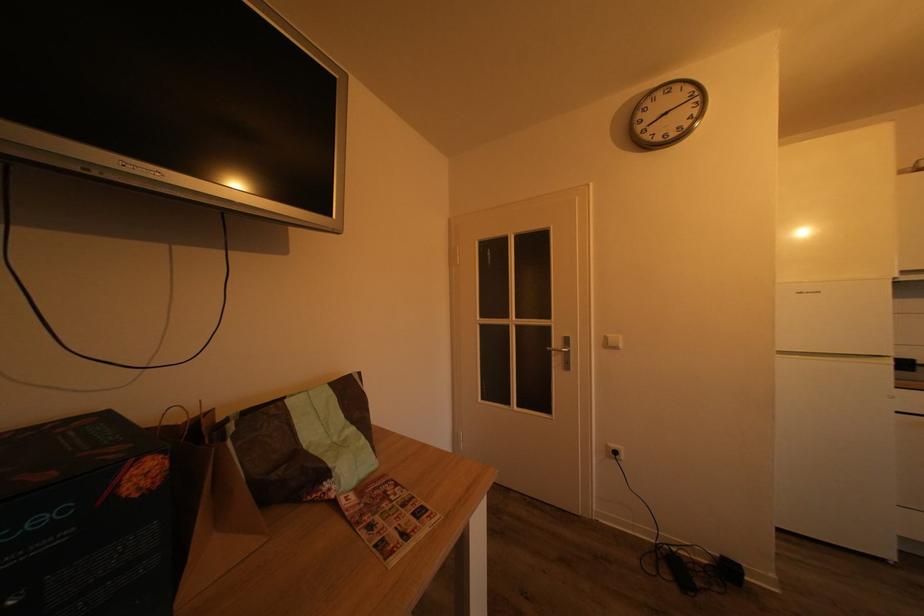
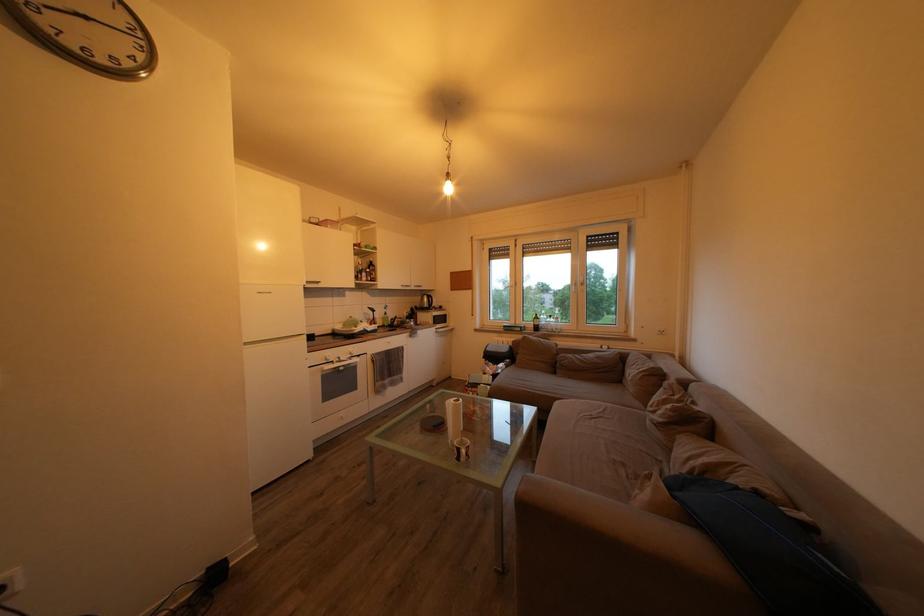
Question: How did the camera likely rotate?

Choices:
 (A) Left
 (B) Right
 (C) Up
 (D) Down

Answer: (B)